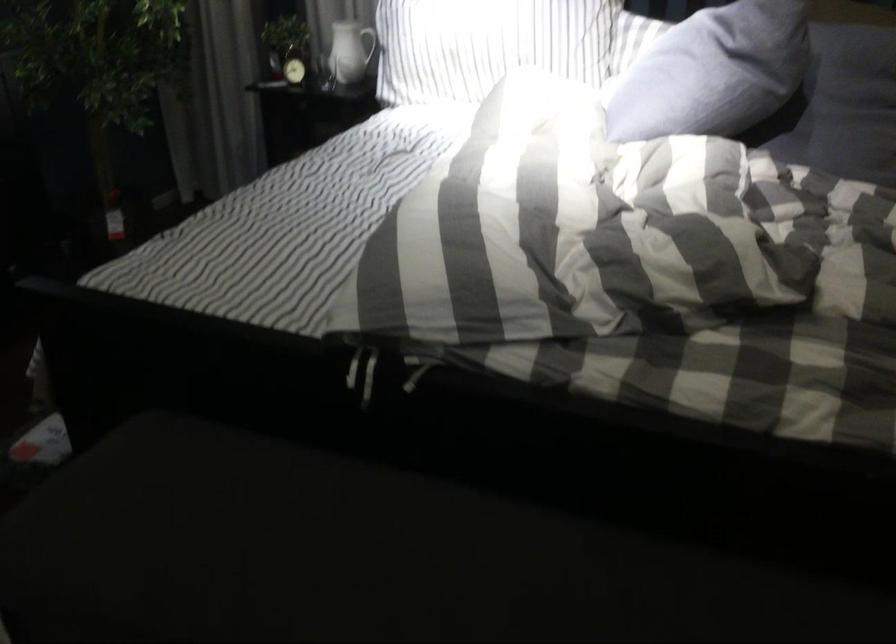
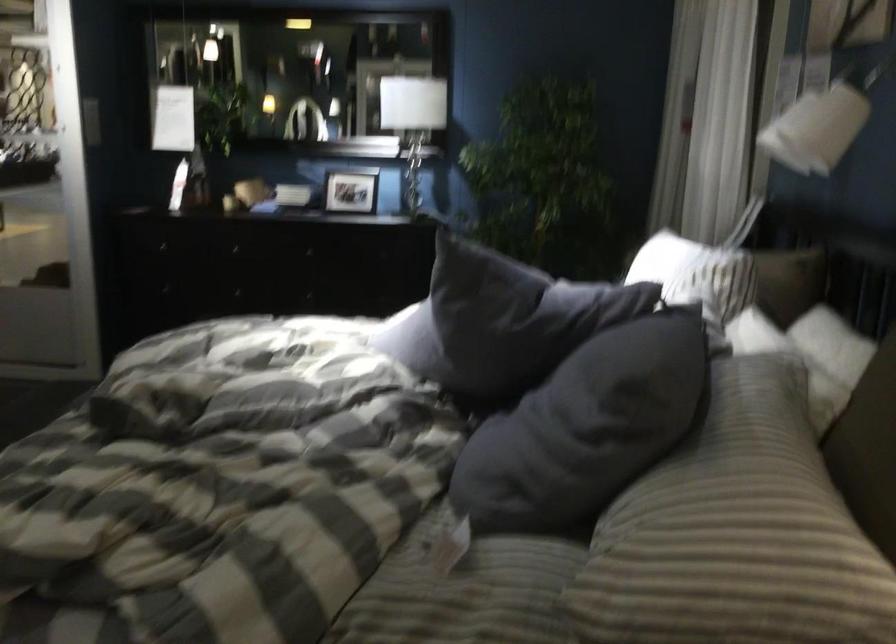
Question: I am providing you with two images of the same scene from different viewpoints. Please identify which objects are invisible in image2.

Choices:
 (A) small picture frame
 (B) small window pane
 (C) pitcher handle
 (D) stack of books

Answer: (C)